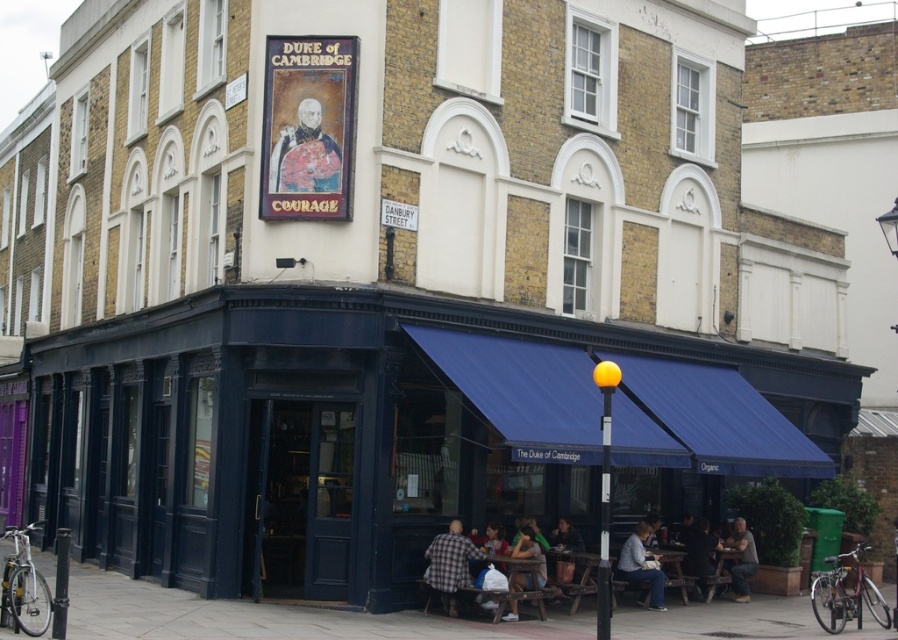
Who is more distant from viewer, [629,554] or [741,538]?

The point [741,538] is more distant.

Is light gray sweater at lower center to the right of brown leather jacket at lower right from the viewer's perspective?

Incorrect, light gray sweater at lower center is not on the right side of brown leather jacket at lower right.

This screenshot has height=640, width=898. Find the location of `light gray sweater at lower center`. light gray sweater at lower center is located at coordinates (641, 564).

Can you confirm if matte gold portrait at upper center is thinner than brown leather jacket at lower right?

No.

Is point (320, 156) positioned in front of point (754, 570)?

Yes, it is.

Locate an element on the screen. This screenshot has width=898, height=640. matte gold portrait at upper center is located at coordinates (305, 156).

Between matte gold portrait at upper center and dark blue shirt at lower right, which one is positioned higher?

Positioned higher is matte gold portrait at upper center.

Who is positioned more to the right, matte gold portrait at upper center or dark blue shirt at lower right?

Positioned to the right is dark blue shirt at lower right.

Describe the element at coordinates (305, 156) in the screenshot. Image resolution: width=898 pixels, height=640 pixels. I see `matte gold portrait at upper center` at that location.

What are the coordinates of `matte gold portrait at upper center` in the screenshot? It's located at (305, 156).